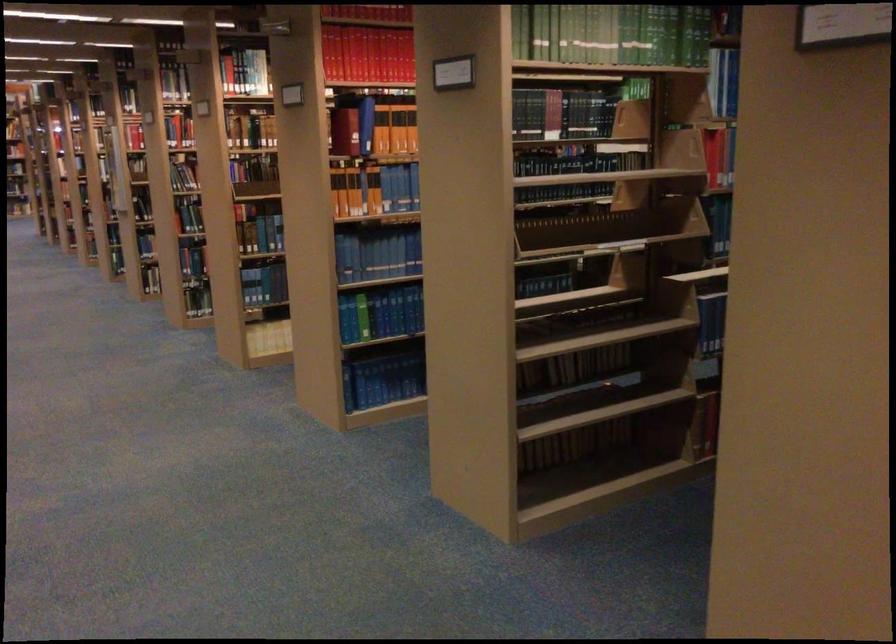
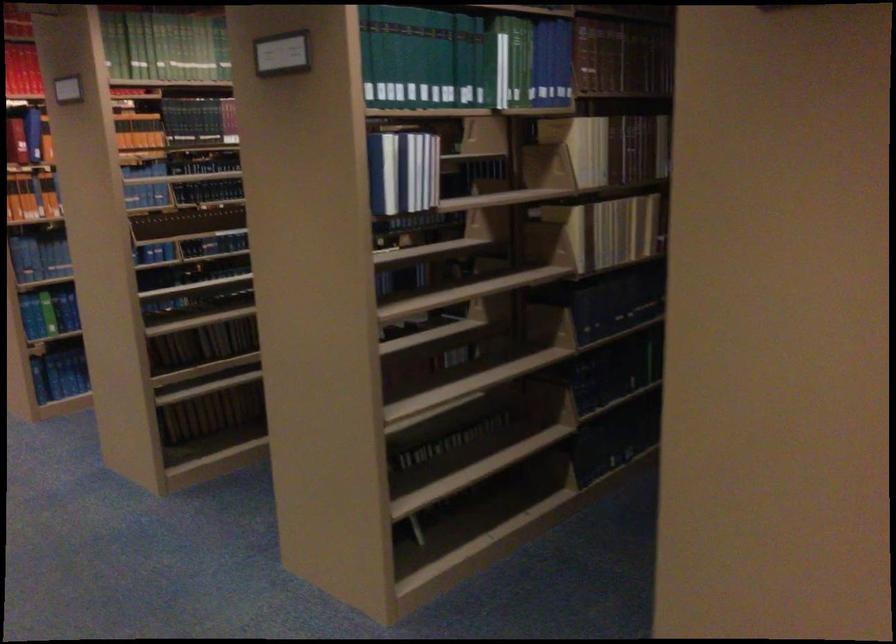
Question: The camera is either moving clockwise (left) or counter-clockwise (right) around the object. The first image is from the beginning of the video and the second image is from the end. Is the camera moving left or right when shooting the video?

Choices:
 (A) Left
 (B) Right

Answer: (A)